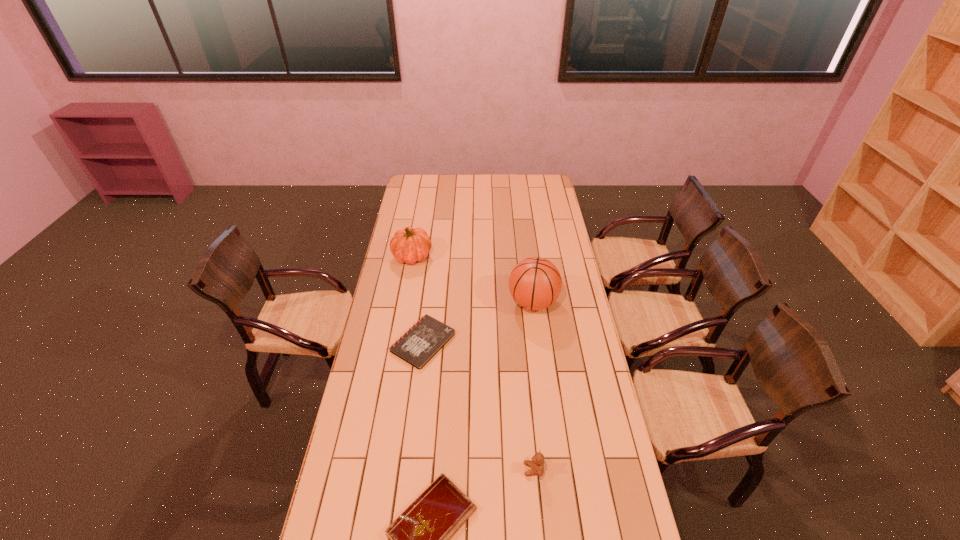
Identify the location of free space located on the back of the farther notebook. (432, 269).

You are a GUI agent. You are given a task and a screenshot of the screen. Output one action in this format:
    pyautogui.click(x=<x>, y=<y>)
    Task: Click on the pumpkin present at the left edge
    
    Given the screenshot: What is the action you would take?
    pyautogui.click(x=409, y=245)

At what (x,y) coordinates should I click in order to perform the action: click on notebook present at the left edge. Please return your answer as a coordinate pair (x, y). Looking at the image, I should click on (418, 345).

Locate an element on the screen. object present at the right edge is located at coordinates (535, 283).

The height and width of the screenshot is (540, 960). Identify the location of vacant region at the left edge of the desktop. (417, 202).

I want to click on vacant area at the right edge, so click(x=597, y=464).

Locate an element on the screen. This screenshot has height=540, width=960. blank area at the far right corner is located at coordinates (532, 177).

Image resolution: width=960 pixels, height=540 pixels. I want to click on vacant region between the third tallest object and the farther notebook, so click(478, 406).

Locate an element on the screen. The height and width of the screenshot is (540, 960). vacant space in between the farther notebook and the tallest object is located at coordinates (478, 322).

The height and width of the screenshot is (540, 960). Identify the location of free space between the basketball and the farther notebook. pyautogui.click(x=478, y=322).